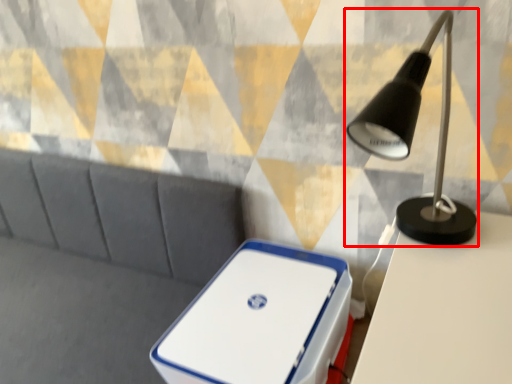
Question: Observing the image, what is the correct spatial positioning of lamp (annotated by the red box) in reference to storage box?

Choices:
 (A) right
 (B) left

Answer: (A)